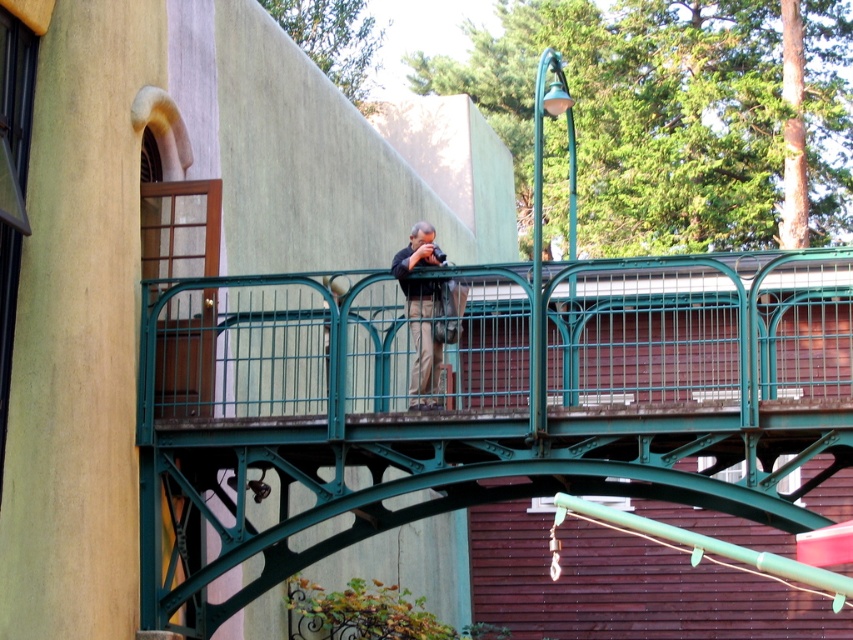
Which is above, green metal bridge at center or black fabric camera at center?

black fabric camera at center is higher up.

Who is more forward, (782, 300) or (416, 384)?

Point (416, 384)

Is point (224, 486) farther from viewer compared to point (437, 349)?

Yes.

Locate an element on the screen. This screenshot has width=853, height=640. green metal bridge at center is located at coordinates (474, 403).